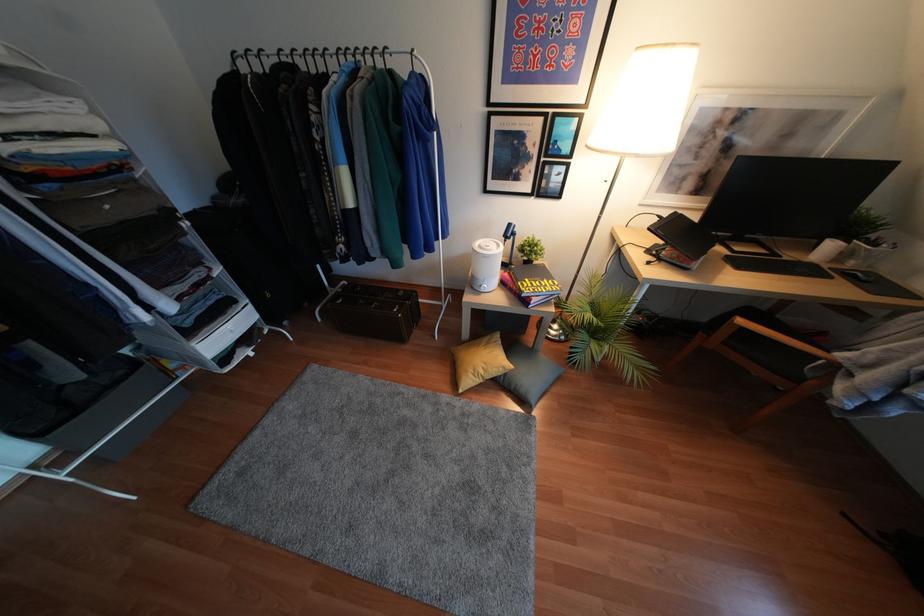
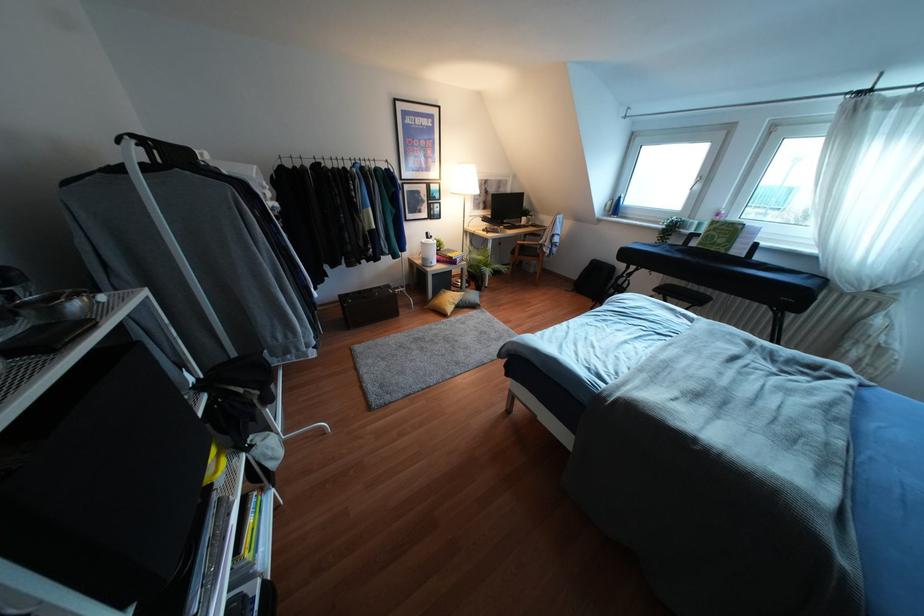
Locate, in the second image, the point that corresponds to (484,339) in the first image.

(441, 292)